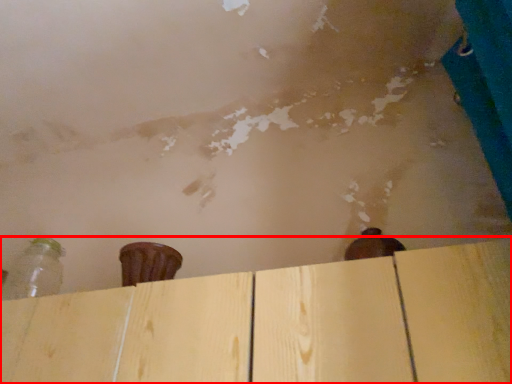
Question: From the image's perspective, where is plywood (annotated by the red box) located relative to bottle?

Choices:
 (A) below
 (B) above

Answer: (A)